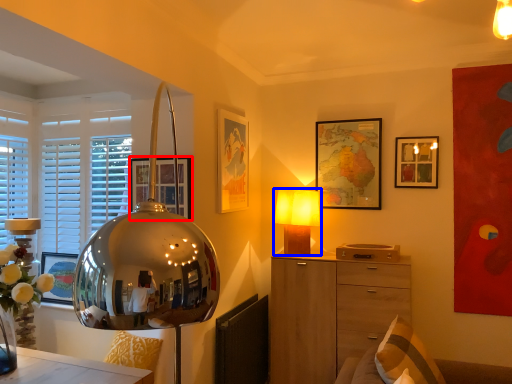
Question: Which object is closer to the camera taking this photo, picture frame (highlighted by a red box) or lamp (highlighted by a blue box)?

Choices:
 (A) picture frame
 (B) lamp

Answer: (A)